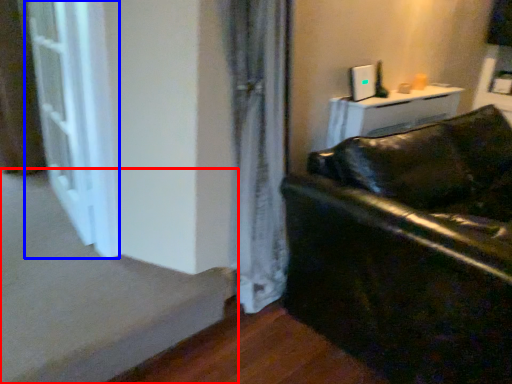
Question: Which point is closer to the camera, stairwell (highlighted by a red box) or screen door (highlighted by a blue box)?

Choices:
 (A) stairwell
 (B) screen door

Answer: (A)